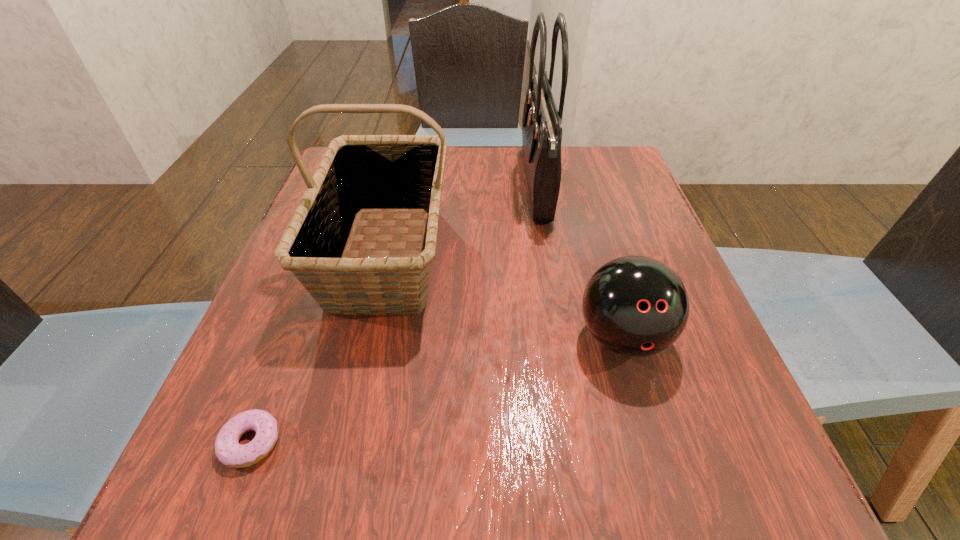
Locate which object ranks in proximity to the tallest object. Please provide its 2D coordinates. Your answer should be formatted as a tuple, i.e. [(x, y)], where the tuple contains the x and y coordinates of a point satisfying the conditions above.

[(358, 174)]

At what (x,y) coordinates should I click in order to perform the action: click on object identified as the second closest to the second tallest object. Please return your answer as a coordinate pair (x, y). The width and height of the screenshot is (960, 540). Looking at the image, I should click on (542, 123).

This screenshot has height=540, width=960. In order to click on free region that satisfies the following two spatial constraints: 1. with an open clasp on the front of the tallest object; 2. by the handle of the second tallest object in this screenshot , I will do `click(548, 254)`.